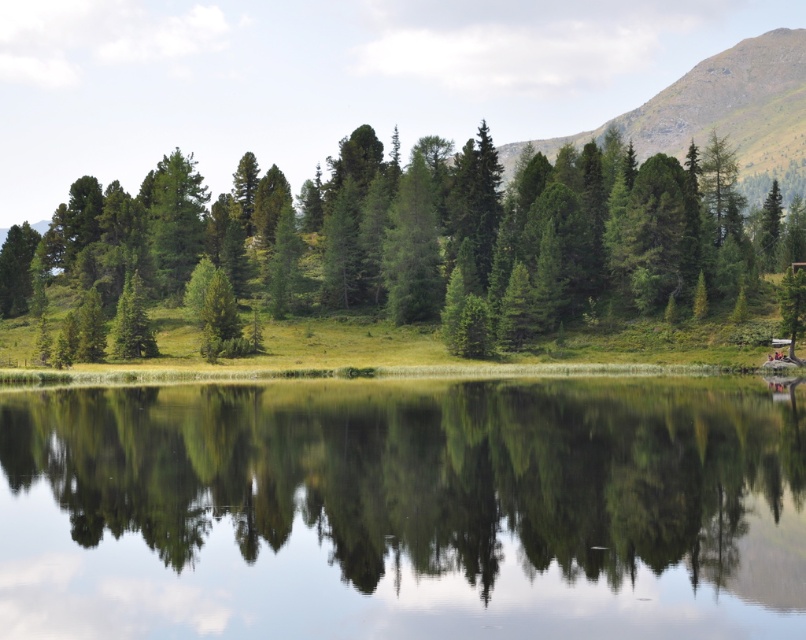
You are an outdoor photographer wanting to capture the reflection of both the green matte tree at center and the green grassy mountain at upper right in the water. Which object will have a larger reflection in the water?

The green grassy mountain at upper right has a larger reflection in the water because it is taller than the green matte tree at center.